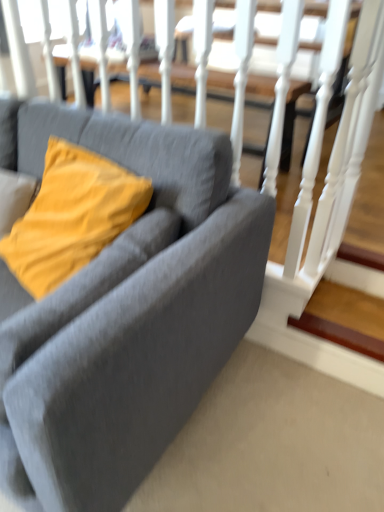
Question: Is wooden at lower right directly adjacent to matte yellow pillow at left?

Choices:
 (A) no
 (B) yes

Answer: (A)

Question: Is wooden at lower right behind matte yellow pillow at left?

Choices:
 (A) no
 (B) yes

Answer: (B)

Question: Can you confirm if wooden at lower right is thinner than matte yellow pillow at left?

Choices:
 (A) yes
 (B) no

Answer: (A)

Question: From the image's perspective, is wooden at lower right on matte yellow pillow at left?

Choices:
 (A) yes
 (B) no

Answer: (B)

Question: Can you confirm if wooden at lower right is bigger than matte yellow pillow at left?

Choices:
 (A) yes
 (B) no

Answer: (B)

Question: Would you say wooden at lower right is a long distance from matte yellow pillow at left?

Choices:
 (A) no
 (B) yes

Answer: (A)

Question: Is matte gray couch at center not within wooden at lower right?

Choices:
 (A) yes
 (B) no

Answer: (A)

Question: Is matte gray couch at center smaller than wooden at lower right?

Choices:
 (A) yes
 (B) no

Answer: (B)

Question: From the image's perspective, is matte gray couch at center below wooden at lower right?

Choices:
 (A) no
 (B) yes

Answer: (A)

Question: Is matte gray couch at center turned away from wooden at lower right?

Choices:
 (A) no
 (B) yes

Answer: (A)

Question: From a real-world perspective, is matte gray couch at center physically above wooden at lower right?

Choices:
 (A) no
 (B) yes

Answer: (B)

Question: Is matte gray couch at center positioned far away from wooden at lower right?

Choices:
 (A) yes
 (B) no

Answer: (B)

Question: Would you consider matte gray couch at center to be distant from matte yellow pillow at left?

Choices:
 (A) yes
 (B) no

Answer: (B)